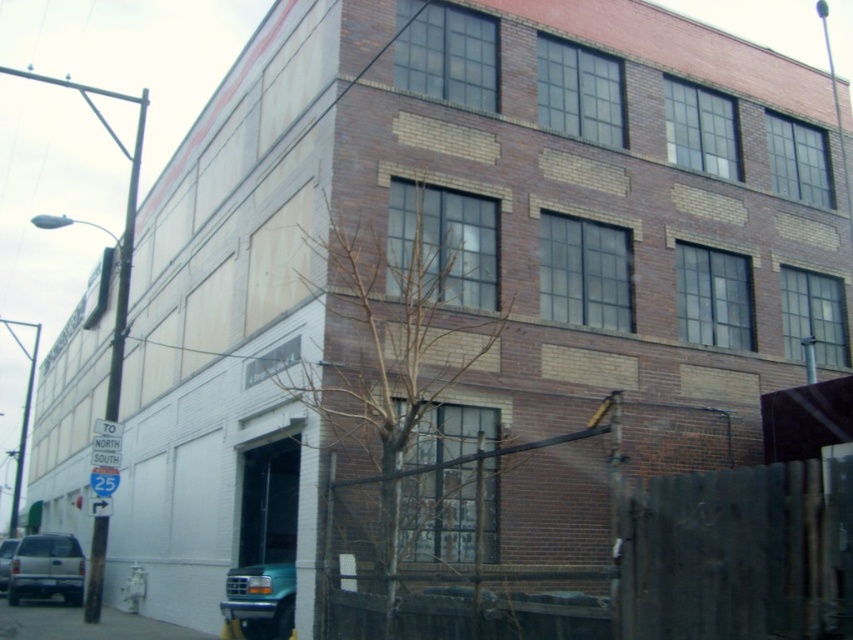
Is bare branches at center further to camera compared to teal matte truck at lower left?

No, bare branches at center is closer to the viewer.

Can you confirm if bare branches at center is thinner than teal matte truck at lower left?

Correct, bare branches at center's width is less than teal matte truck at lower left's.

The width and height of the screenshot is (853, 640). I want to click on bare branches at center, so click(399, 364).

Locate an element on the screen. bare branches at center is located at coordinates (399, 364).

From the picture: Can you confirm if bare branches at center is positioned above matte silver suv at lower left?

Indeed, bare branches at center is positioned over matte silver suv at lower left.

Does bare branches at center have a larger size compared to matte silver suv at lower left?

Yes.

Locate an element on the screen. Image resolution: width=853 pixels, height=640 pixels. bare branches at center is located at coordinates (399, 364).

The height and width of the screenshot is (640, 853). I want to click on bare branches at center, so click(399, 364).

Is point (49, 540) in front of point (1, 588)?

Yes, point (49, 540) is closer to viewer.

Describe the element at coordinates (45, 568) in the screenshot. Image resolution: width=853 pixels, height=640 pixels. I see `matte silver suv at lower left` at that location.

Is point (28, 545) farther from camera compared to point (15, 541)?

No, it is in front of (15, 541).

Image resolution: width=853 pixels, height=640 pixels. Identify the location of matte silver suv at lower left. (45, 568).